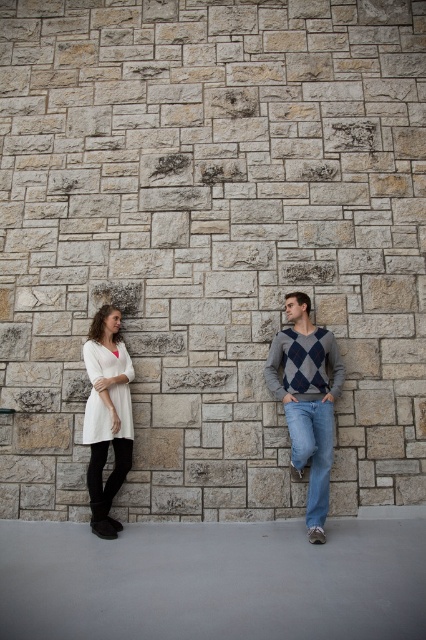
You are a photographer setting up a shot for a clothing catalog. You have to decide whether to place the argyle sweater at center and denim jeans at lower right side by side. Given their sizes, will they fit within a 1.2 meter wide frame?

The argyle sweater at center is wider than the denim jeans at lower right. Since the total width of both items combined would exceed 1.2 meters, they might not fit side by side within the frame.

You are a photographer trying to capture a closeup of the argyle sweater at center. Based on the scene description, where should you position your camera relative to the two individuals?

The argyle sweater at center is located at point (307, 401), so you should position your camera to focus on that coordinate to capture the closeup.

You are a photographer setting up for a shoot. You need to position a light to the left of the white matte tunic at left and another light to the right of the argyle sweater at center. Will the two lights be placed on the same side of the image?

The argyle sweater at center is to the right of the white matte tunic at left, so placing a light to the left of the white matte tunic at left and another to the right of the argyle sweater at center would result in the two lights being on opposite sides of the image.